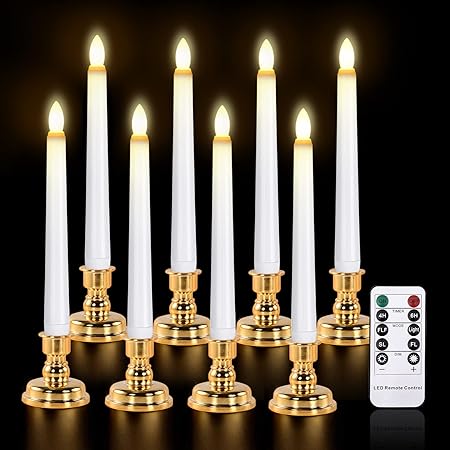
You are a GUI agent. You are given a task and a screenshot of the screen. Output one action in this format:
    pyautogui.click(x=<x>, y=<y>)
    Task: Click on the candle wax
    Image resolution: width=450 pixels, height=450 pixels.
    Given the screenshot: What is the action you would take?
    pyautogui.click(x=55, y=226), pyautogui.click(x=92, y=211), pyautogui.click(x=137, y=223), pyautogui.click(x=176, y=219), pyautogui.click(x=221, y=233), pyautogui.click(x=262, y=224), pyautogui.click(x=302, y=235), pyautogui.click(x=340, y=228)